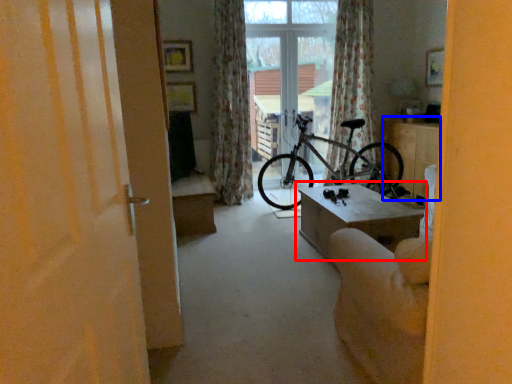
Question: Among these objects, which one is nearest to the camera, table (highlighted by a red box) or table (highlighted by a blue box)?

Choices:
 (A) table
 (B) table

Answer: (A)